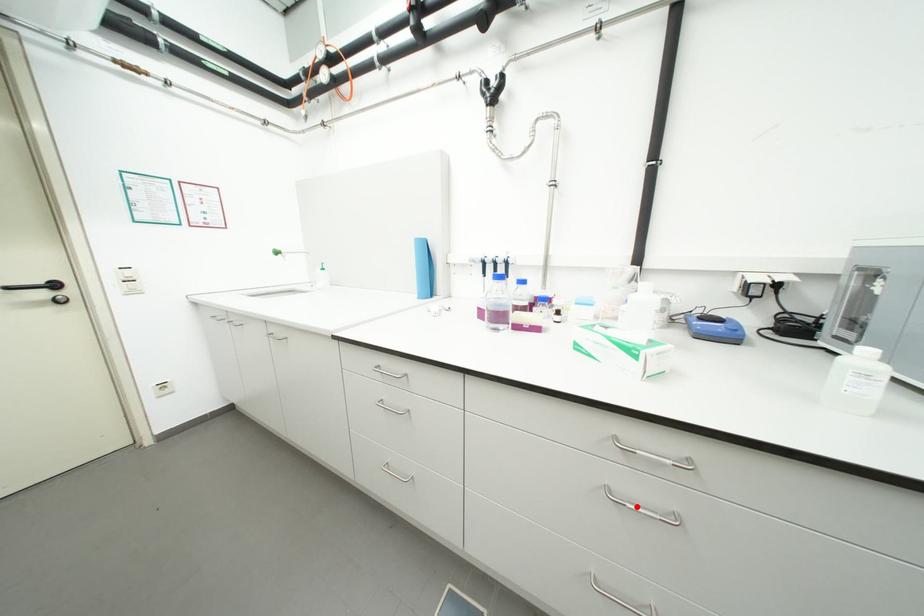
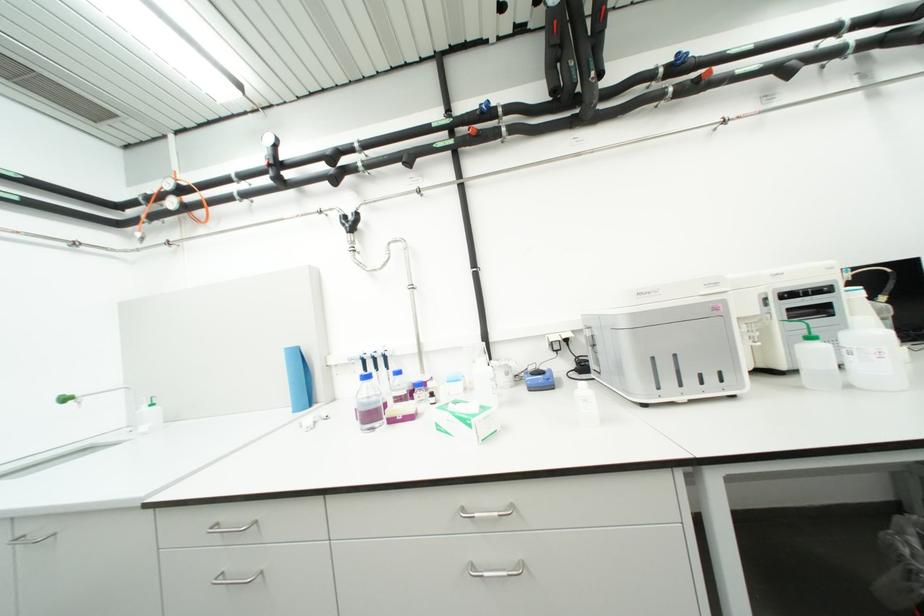
Where in the second image is the point corresponding to the highlighted location from the first image?

(493, 575)